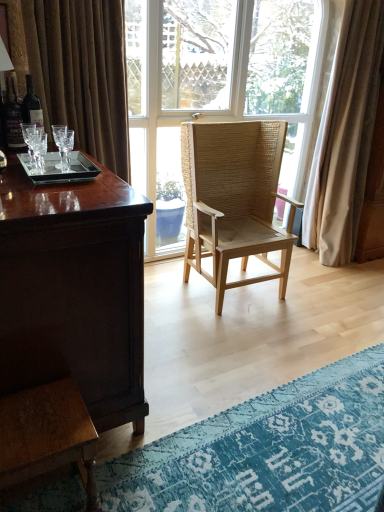
What do you see at coordinates (46, 435) in the screenshot? I see `wooden table at lower left` at bounding box center [46, 435].

Image resolution: width=384 pixels, height=512 pixels. Describe the element at coordinates (59, 169) in the screenshot. I see `clear glass tray at left` at that location.

Locate an element on the screen. The width and height of the screenshot is (384, 512). natural woven wood chair at center is located at coordinates (234, 199).

Is dark glass bottle at left beside clear glass tray at left?

No, dark glass bottle at left is not in contact with clear glass tray at left.

Consider the image. How far apart are dark glass bottle at left and clear glass tray at left?

A distance of 16.43 inches exists between dark glass bottle at left and clear glass tray at left.

From the image's perspective, between dark glass bottle at left and clear glass tray at left, which one is located above?

dark glass bottle at left, from the image's perspective.

Based on the photo, considering the relative positions of dark glass bottle at left and clear glass tray at left in the image provided, is dark glass bottle at left behind clear glass tray at left?

Yes, the depth of dark glass bottle at left is greater than that of clear glass tray at left.

Does blue textured rug at lower right contain natural woven wood chair at center?

No, natural woven wood chair at center is not a part of blue textured rug at lower right.

Is blue textured rug at lower right wider than natural woven wood chair at center?

Yes, blue textured rug at lower right is wider than natural woven wood chair at center.

Locate an element on the screen. The height and width of the screenshot is (512, 384). mat in front of the natural woven wood chair at center is located at coordinates (268, 451).

Does blue textured rug at lower right appear on the left side of natural woven wood chair at center?

No, blue textured rug at lower right is not to the left of natural woven wood chair at center.

Which of these two, wooden table at lower left or natural woven wood chair at center, stands shorter?

wooden table at lower left is shorter.

Could you tell me if wooden table at lower left is turned towards natural woven wood chair at center?

No, wooden table at lower left is not turned towards natural woven wood chair at center.

Which of these two, wooden table at lower left or natural woven wood chair at center, is thinner?

Thinner between the two is wooden table at lower left.

Can you tell me how much wooden table at lower left and natural woven wood chair at center differ in facing direction?

The angle between the facing direction of wooden table at lower left and the facing direction of natural woven wood chair at center is 90.2 degrees.

From the picture: Is clear glass tray at left inside or outside of matte black bottle at left?

clear glass tray at left exists outside the volume of matte black bottle at left.

Does clear glass tray at left have a greater height compared to matte black bottle at left?

No.

Which object is wider, clear glass tray at left or matte black bottle at left?

Wider between the two is clear glass tray at left.

Considering the relative sizes of clear glass tray at left and matte black bottle at left in the image provided, is clear glass tray at left bigger than matte black bottle at left?

Yes.

Which is closer to the camera, (39, 184) or (23, 116)?

The point (39, 184) is more forward.

Is dark glass bottle at left inside clear glass tray at left?

No, dark glass bottle at left is located outside of clear glass tray at left.

The image size is (384, 512). Identify the location of tray lying in front of the matte black bottle at left. 59,169.

Is the position of matte black bottle at left more distant than that of clear glass tray at left?

Yes, it is.

Considering the relative positions of matte black bottle at left and clear glass tray at left in the image provided, is matte black bottle at left to the left of clear glass tray at left from the viewer's perspective?

Yes, matte black bottle at left is to the left of clear glass tray at left.

Can clear glass tray at left be found inside matte black bottle at left?

No, clear glass tray at left is not a part of matte black bottle at left.

Is dark glass bottle at left spatially inside clear glass window at center, or outside of it?

dark glass bottle at left cannot be found inside clear glass window at center.

Which is more to the right, dark glass bottle at left or clear glass window at center?

clear glass window at center is more to the right.

Between dark glass bottle at left and clear glass window at center, which one has less height?

dark glass bottle at left.

Find the location of `tray on the right of dark glass bottle at left`. tray on the right of dark glass bottle at left is located at coordinates coord(59,169).

I want to click on mat directly beneath the natural woven wood chair at center (from a real-world perspective), so click(x=268, y=451).

Based on their spatial positions, is natural woven wood chair at center or clear glass window at center closer to wooden table at lower left?

natural woven wood chair at center lies closer to wooden table at lower left than the other object.

Estimate the real-world distances between objects in this image. Which object is further from clear glass window at center, matte black bottle at left or beige fabric curtain at right?

The object further to clear glass window at center is matte black bottle at left.

Looking at the image, which one is located further to wooden table at lower left, blue textured rug at lower right or clear glass window at center?

Based on the image, clear glass window at center appears to be further to wooden table at lower left.

Estimate the real-world distances between objects in this image. Which object is further from natural woven wood chair at center, wooden table at lower left or matte black bottle at left?

Based on the image, wooden table at lower left appears to be further to natural woven wood chair at center.

Based on their spatial positions, is beige fabric curtain at right or blue textured rug at lower right further from clear glass window at center?

Based on the image, blue textured rug at lower right appears to be further to clear glass window at center.

Looking at the image, which one is located closer to shiny brown wood desk at left, beige fabric curtain at right or matte black bottle at left?

matte black bottle at left is closer to shiny brown wood desk at left.

Looking at the image, which one is located closer to clear glass window at center, clear glass tray at left or natural woven wood chair at center?

natural woven wood chair at center lies closer to clear glass window at center than the other object.

Looking at the image, which one is located closer to dark glass bottle at left, natural woven wood chair at center or clear glass window at center?

The object closer to dark glass bottle at left is natural woven wood chair at center.

You are a GUI agent. You are given a task and a screenshot of the screen. Output one action in this format:
    pyautogui.click(x=<x>, y=<y>)
    Task: Click on the tray between shiny brown wood desk at left and clear glass window at center from front to back
    Image resolution: width=384 pixels, height=512 pixels.
    Given the screenshot: What is the action you would take?
    pyautogui.click(x=59, y=169)

You are a GUI agent. You are given a task and a screenshot of the screen. Output one action in this format:
    pyautogui.click(x=<x>, y=<y>)
    Task: Click on the desk that lies between dark glass bottle at left and wooden table at lower left from top to bottom
    This screenshot has width=384, height=512.
    Given the screenshot: What is the action you would take?
    pyautogui.click(x=74, y=291)

At what (x,y) coordinates should I click in order to perform the action: click on tray located between dark glass bottle at left and beige fabric curtain at right in the left-right direction. Please return your answer as a coordinate pair (x, y). Image resolution: width=384 pixels, height=512 pixels. Looking at the image, I should click on 59,169.

The image size is (384, 512). What are the coordinates of `chair situated between clear glass window at center and beige fabric curtain at right from left to right` in the screenshot? It's located at (234, 199).